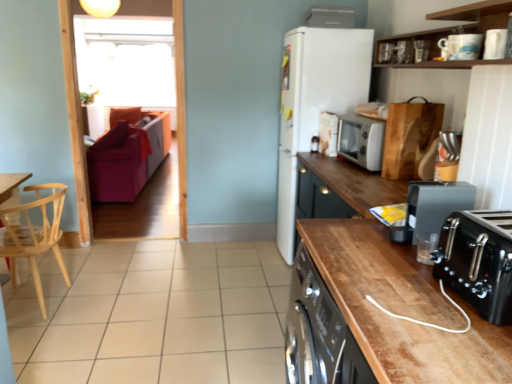
Question: Considering the positions of white glossy microwave at upper right, the sixth appliance in the right-to-left sequence, and metallic silver toaster at upper right, which is counted as the second appliance, starting from the right, in the image, is white glossy microwave at upper right, the sixth appliance in the right-to-left sequence, taller or shorter than metallic silver toaster at upper right, which is counted as the second appliance, starting from the right,?

Choices:
 (A) tall
 (B) short

Answer: (A)

Question: Looking at their shapes, would you say white glossy microwave at upper right, the 1th appliance in the left-to-right sequence, is wider or thinner than metallic silver toaster at upper right, the fifth appliance when ordered from left to right?

Choices:
 (A) wide
 (B) thin

Answer: (A)

Question: Considering the real-world distances, which object is closest to the matte white coffee maker at upper center, marked as the first appliance in a back-to-front arrangement?

Choices:
 (A) metallic silver toaster at upper right, which is counted as the second appliance, starting from the right
 (B) metallic silver toaster at upper right, which is the 6th appliance from left to right
 (C) velvet purple armchair at left
 (D) beige tile at lower center
 (E) black wood countertop at lower right

Answer: (A)

Question: Estimate the real-world distances between objects in this image. Which object is closer to the metallic gray coffee machine at right, which ranks as the 2th kitchen appliance in bottom-to-top order?

Choices:
 (A) transparent glass window screen at upper left
 (B) metallic silver toaster at upper right, acting as the 2th appliance starting from the top
 (C) metallic silver toaster at upper right, which is the 6th appliance from left to right
 (D) white glossy microwave at upper right, which is counted as the first appliance, starting from the bottom
 (E) white matte refrigerator at center

Answer: (C)